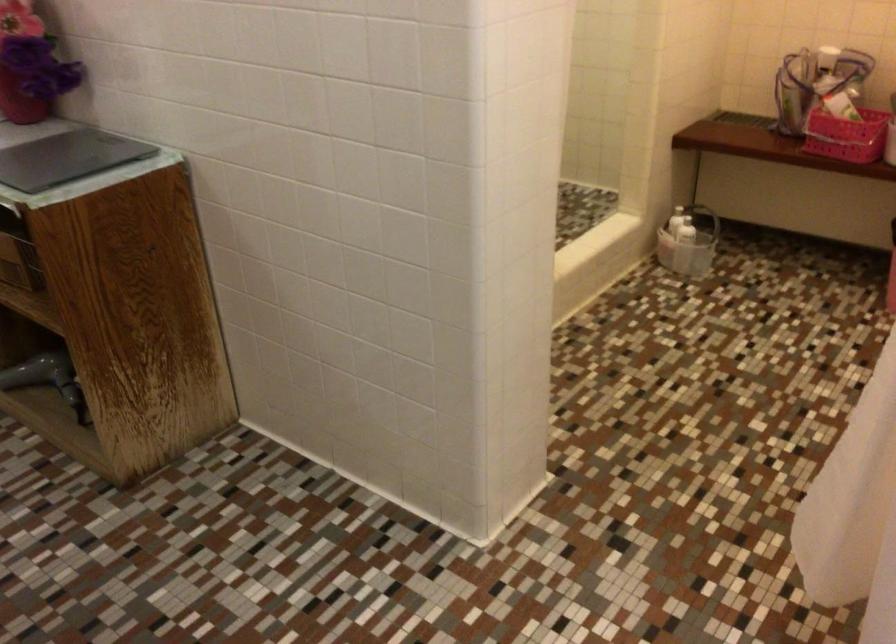
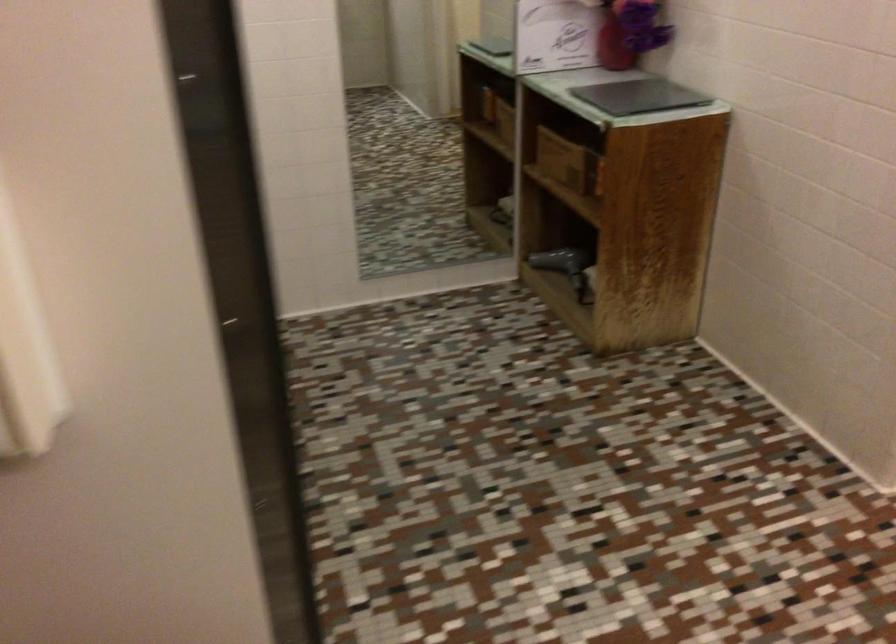
The point at (78, 152) is marked in the first image. Where is the corresponding point in the second image?

(639, 96)